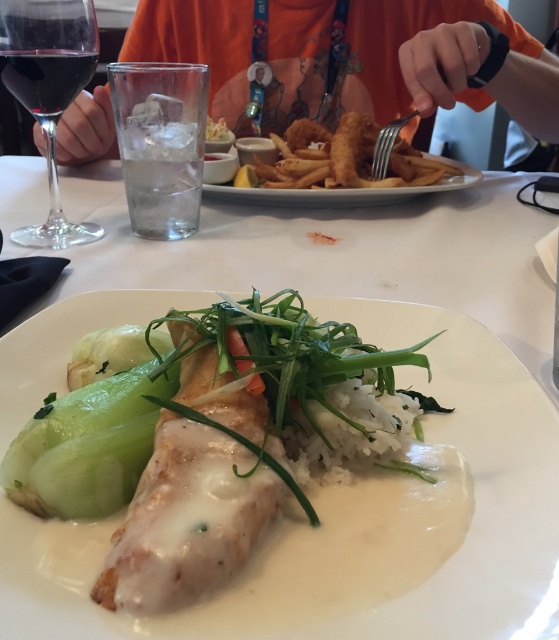
Which is above, transparent glass at upper left or golden crispy fries at center?

golden crispy fries at center

Who is shorter, transparent glass at upper left or golden crispy fries at center?

golden crispy fries at center

Between point (15, 81) and point (338, 156), which one is positioned in front?

Point (15, 81) is in front.

At what (x,y) coordinates should I click in order to perform the action: click on transparent glass at upper left. Please return your answer as a coordinate pair (x, y). The height and width of the screenshot is (640, 559). Looking at the image, I should click on (49, 90).

Does point (482, 481) come closer to viewer compared to point (18, 81)?

Yes, it is.

Who is taller, white creamy sauce at center or dark red glass at upper left?

white creamy sauce at center is taller.

Between point (476, 445) and point (56, 100), which one is positioned in front?

Point (476, 445) is in front.

This screenshot has width=559, height=640. Identify the location of white creamy sauce at center. (357, 524).

Between golden crispy fries at center and silver metallic fork at upper center, which one has more height?

With more height is golden crispy fries at center.

Who is more forward, (258,170) or (387,125)?

Point (258,170) is more forward.

Locate an element on the screen. golden crispy fries at center is located at coordinates (343, 157).